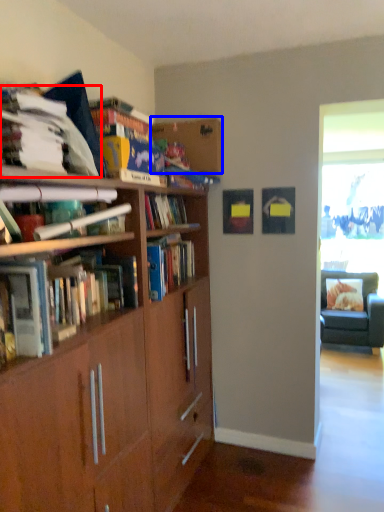
Question: Which object appears closest to the camera in this image, book (highlighted by a red box) or shelf (highlighted by a blue box)?

Choices:
 (A) book
 (B) shelf

Answer: (A)